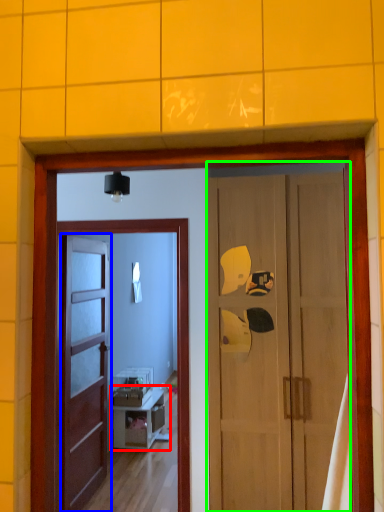
Question: Considering the real-world distances, which object is farthest from cabinetry (highlighted by a red box)? door (highlighted by a blue box) or door (highlighted by a green box)?

Choices:
 (A) door
 (B) door

Answer: (B)